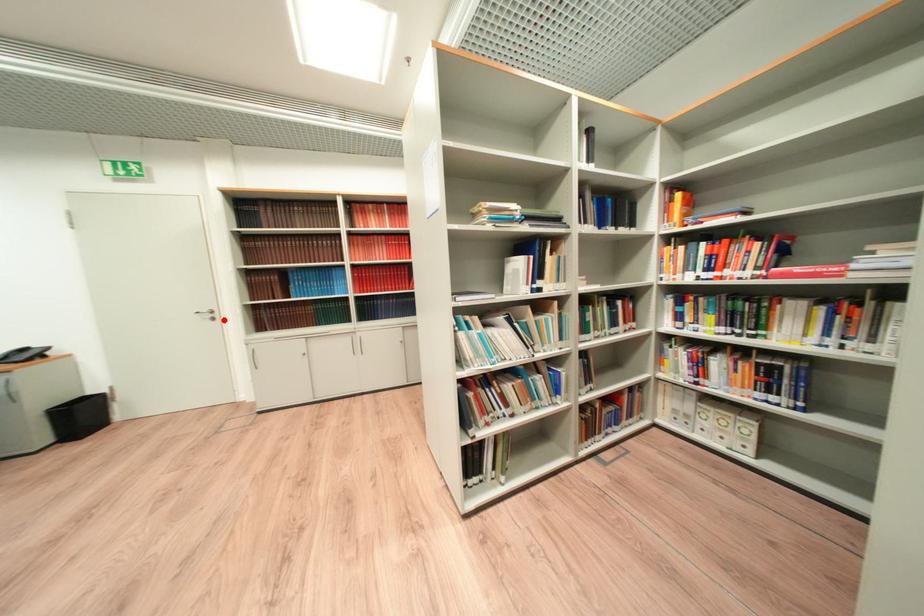
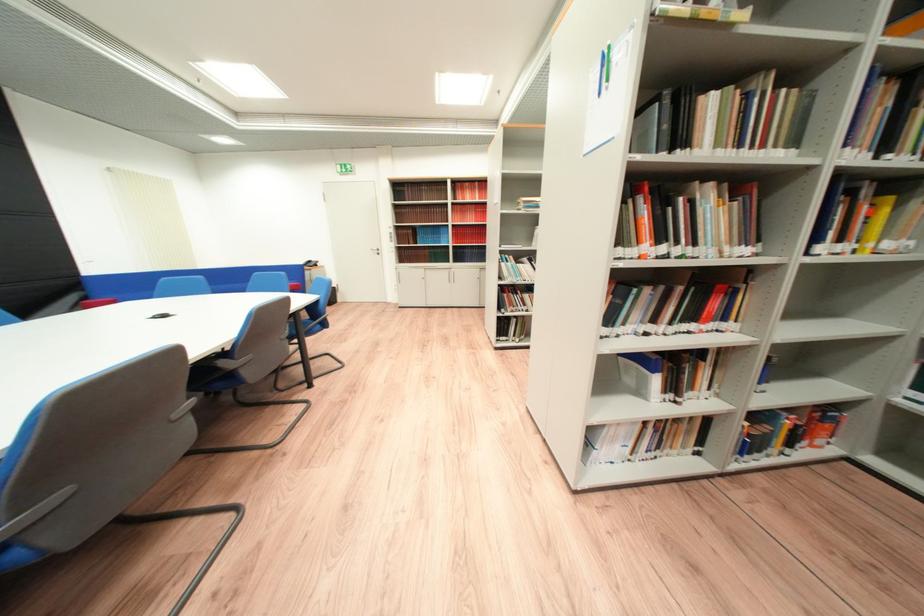
Question: I am providing you with two images of the same scene from different viewpoints. A red point is shown in image1. For the corresponding object point in image2, is it positioned nearer or farther from the camera?

Choices:
 (A) Nearer
 (B) Farther

Answer: (A)